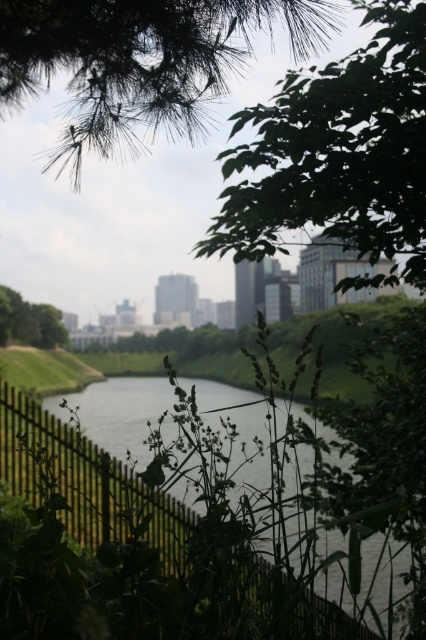
Question: From the image, what is the correct spatial relationship of green leafy tree at upper center in relation to green metal fence at lower center?

Choices:
 (A) above
 (B) below

Answer: (A)

Question: Is green leafy tree at upper center to the right of green leafy tree at center from the viewer's perspective?

Choices:
 (A) no
 (B) yes

Answer: (B)

Question: Which of these objects is positioned farthest from the green needle-like leaves at upper center?

Choices:
 (A) green leafy tree at upper center
 (B) green leafy tree at center
 (C) green metal fence at lower center

Answer: (C)

Question: Can you confirm if green needle-like leaves at upper center is positioned to the left of green leafy tree at center?

Choices:
 (A) yes
 (B) no

Answer: (B)

Question: Which object appears closest to the camera in this image?

Choices:
 (A) green leafy tree at upper center
 (B) green leafy tree at center
 (C) green needle-like leaves at upper center

Answer: (C)

Question: Among these objects, which one is nearest to the camera?

Choices:
 (A) green leafy tree at upper center
 (B) green leafy tree at center

Answer: (A)